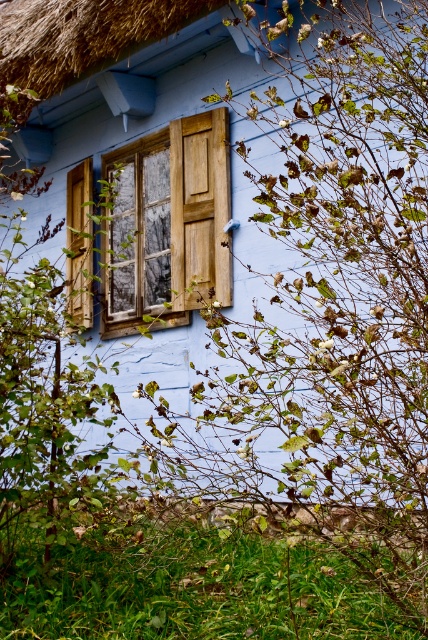
Question: Which point is farther to the camera?

Choices:
 (A) wooden at left
 (B) thatched straw roof at upper center

Answer: (A)

Question: Is thatched straw roof at upper center positioned in front of wooden at left?

Choices:
 (A) no
 (B) yes

Answer: (B)

Question: Is thatched straw roof at upper center positioned in front of wooden at left?

Choices:
 (A) yes
 (B) no

Answer: (A)

Question: Is thatched straw roof at upper center above wooden at left?

Choices:
 (A) no
 (B) yes

Answer: (B)